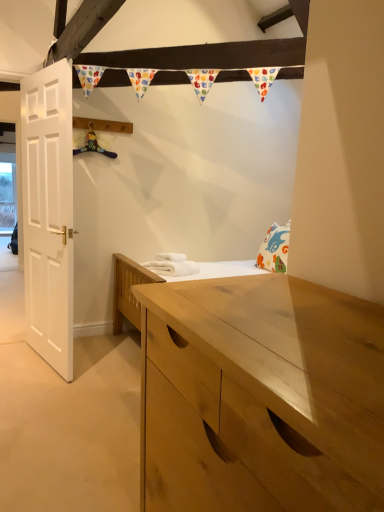
Question: Visually, is white soft towels at center positioned to the left or to the right of white matte door at left?

Choices:
 (A) left
 (B) right

Answer: (B)

Question: Is point (173, 265) closer or farther from the camera than point (49, 248)?

Choices:
 (A) farther
 (B) closer

Answer: (A)

Question: Which is correct: white soft towels at center is inside white matte door at left, or outside of it?

Choices:
 (A) inside
 (B) outside

Answer: (B)

Question: Relative to white soft towels at center, is white matte door at left in front or behind?

Choices:
 (A) behind
 (B) front

Answer: (B)

Question: In the image, is white matte door at left on the left side or the right side of white soft towels at center?

Choices:
 (A) right
 (B) left

Answer: (B)

Question: Considering the positions of white matte door at left and white soft towels at center in the image, is white matte door at left taller or shorter than white soft towels at center?

Choices:
 (A) tall
 (B) short

Answer: (A)

Question: From a real-world perspective, is white matte door at left positioned above or below white soft towels at center?

Choices:
 (A) below
 (B) above

Answer: (B)